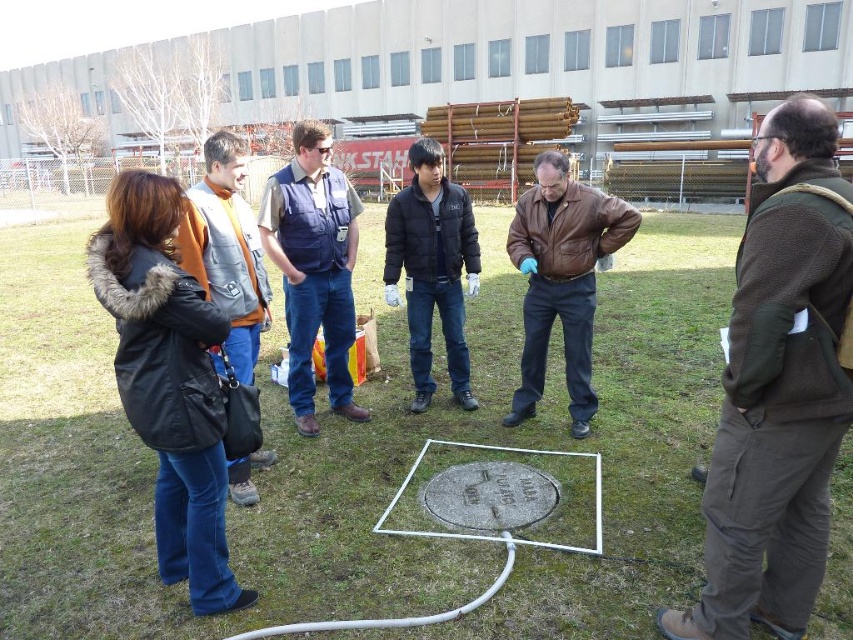
Is brown fuzzy jacket at center bigger than orange fleece vest at left?

No.

Is brown fuzzy jacket at center positioned behind orange fleece vest at left?

No.

I want to click on brown fuzzy jacket at center, so click(778, 388).

Identify the location of brown fuzzy jacket at center. (778, 388).

Does green grass at center have a greater height compared to black fuzzy coat at left?

Yes.

Is point (260, 602) positioned behind point (210, 468)?

Yes, point (260, 602) is farther from viewer.

Measure the distance between point [398,449] and camera.

They are 13.64 feet apart.

Identify the location of green grass at center. (363, 456).

Is black matte jacket at center taller than orange fleece vest at left?

Correct, black matte jacket at center is much taller as orange fleece vest at left.

In order to click on black matte jacket at center in this screenshot , I will do `click(432, 268)`.